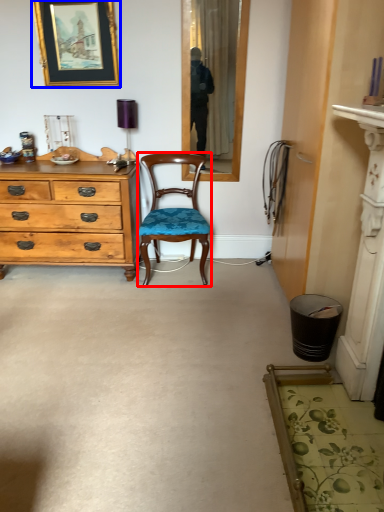
Question: Which object is further to the camera taking this photo, chair (highlighted by a red box) or picture frame (highlighted by a blue box)?

Choices:
 (A) chair
 (B) picture frame

Answer: (B)